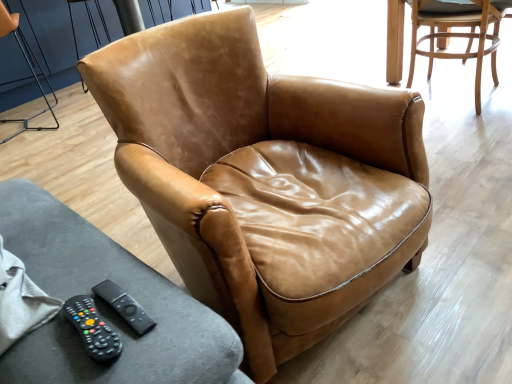
Question: Is black rubber remote at lower left, which is the first remote from front to back, bigger than brown leather armchair at upper center, which is counted as the 1th chair, starting from the left?

Choices:
 (A) yes
 (B) no

Answer: (B)

Question: Can you confirm if black rubber remote at lower left, which is the first remote from front to back, is wider than brown leather armchair at upper center, which appears as the 3th chair when viewed from the right?

Choices:
 (A) yes
 (B) no

Answer: (B)

Question: Is the depth of black rubber remote at lower left, which is the first remote from front to back, greater than that of brown leather armchair at upper center, which appears as the 3th chair when viewed from the right?

Choices:
 (A) no
 (B) yes

Answer: (A)

Question: Is black rubber remote at lower left, which is the first remote from front to back, looking in the opposite direction of brown leather armchair at upper center, which appears as the 3th chair when viewed from the right?

Choices:
 (A) yes
 (B) no

Answer: (A)

Question: Is black rubber remote at lower left, the 2th remote viewed from the back, located outside brown leather armchair at upper center, which is counted as the 1th chair, starting from the left?

Choices:
 (A) no
 (B) yes

Answer: (B)

Question: In the image, is black rubber remote at lower left, the second remote in the front-to-back sequence, on the left side or the right side of cognac leather armchair at center, the second chair viewed from the left?

Choices:
 (A) left
 (B) right

Answer: (A)

Question: Is black rubber remote at lower left, the second remote in the front-to-back sequence, bigger or smaller than cognac leather armchair at center, which ranks as the 2th chair in right-to-left order?

Choices:
 (A) small
 (B) big

Answer: (A)

Question: Considering their positions, is black rubber remote at lower left, placed as the first remote when sorted from back to front, located in front of or behind cognac leather armchair at center, the second chair viewed from the left?

Choices:
 (A) front
 (B) behind

Answer: (B)

Question: Considering the positions of black rubber remote at lower left, placed as the first remote when sorted from back to front, and cognac leather armchair at center, the second chair viewed from the left, in the image, is black rubber remote at lower left, placed as the first remote when sorted from back to front, wider or thinner than cognac leather armchair at center, the second chair viewed from the left,?

Choices:
 (A) wide
 (B) thin

Answer: (B)

Question: Relative to light brown leather chair at upper right, which is the 1th chair in right-to-left order, is cognac leather armchair at center, the second chair viewed from the left, in front or behind?

Choices:
 (A) front
 (B) behind

Answer: (A)

Question: From a real-world perspective, relative to light brown leather chair at upper right, positioned as the 3th chair in left-to-right order, is cognac leather armchair at center, which ranks as the 2th chair in right-to-left order, vertically above or below?

Choices:
 (A) below
 (B) above

Answer: (B)

Question: Would you say cognac leather armchair at center, the second chair viewed from the left, is to the left or to the right of light brown leather chair at upper right, which is the 1th chair in right-to-left order, in the picture?

Choices:
 (A) right
 (B) left

Answer: (B)

Question: Looking at the image, does cognac leather armchair at center, the second chair viewed from the left, seem bigger or smaller compared to light brown leather chair at upper right, positioned as the 3th chair in left-to-right order?

Choices:
 (A) small
 (B) big

Answer: (B)

Question: From a real-world perspective, is black rubber remote at lower left, the second remote in the front-to-back sequence, physically located above or below brown leather armchair at upper center, which is counted as the 1th chair, starting from the left?

Choices:
 (A) below
 (B) above

Answer: (B)

Question: Looking at their shapes, would you say black rubber remote at lower left, placed as the first remote when sorted from back to front, is wider or thinner than brown leather armchair at upper center, which appears as the 3th chair when viewed from the right?

Choices:
 (A) thin
 (B) wide

Answer: (A)